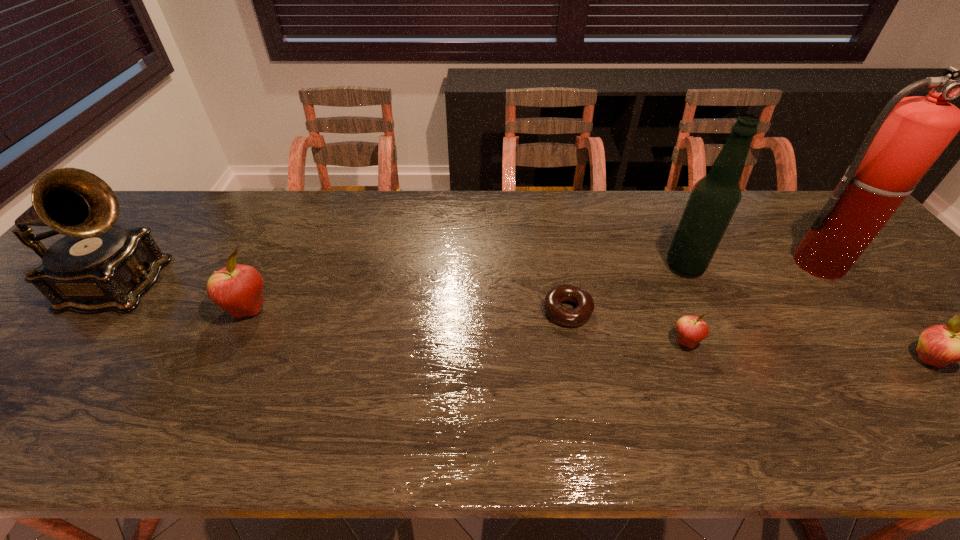
At what (x,y) coordinates should I click in order to perform the action: click on the farthest apple. Please return your answer as a coordinate pair (x, y). This screenshot has height=540, width=960. Looking at the image, I should click on (239, 289).

Locate an element on the screen. the sixth object from right to left is located at coordinates (239, 289).

Where is `the sixth tallest object`? Image resolution: width=960 pixels, height=540 pixels. the sixth tallest object is located at coordinates (691, 330).

Find the location of a particular element. the shortest apple is located at coordinates (691, 330).

Where is `alcohol`? The height and width of the screenshot is (540, 960). alcohol is located at coordinates (714, 198).

Identify the location of fire extinguisher. (910, 133).

At what (x,y) coordinates should I click in order to perform the action: click on phonograph record. Please return your answer as a coordinate pair (x, y). The height and width of the screenshot is (540, 960). Looking at the image, I should click on (97, 266).

Locate an element on the screen. Image resolution: width=960 pixels, height=540 pixels. the fifth shortest object is located at coordinates (97, 266).

At what (x,y) coordinates should I click in order to perform the action: click on the shortest object. Please return your answer as a coordinate pair (x, y). This screenshot has width=960, height=540. Looking at the image, I should click on (553, 299).

Locate an element on the screen. This screenshot has width=960, height=540. doughnut is located at coordinates (553, 299).